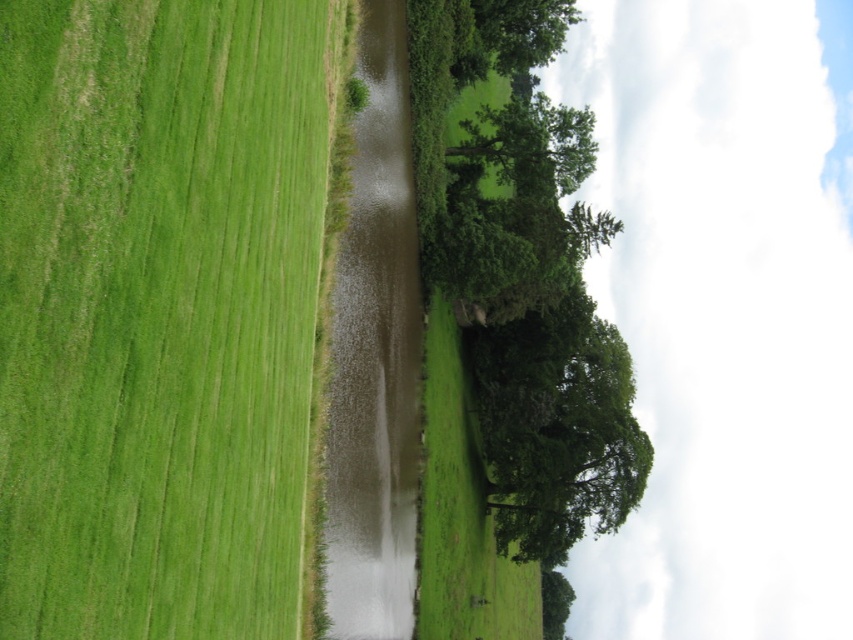
Question: Estimate the real-world distances between objects in this image. Which object is closer to the green leafy tree at center?

Choices:
 (A) muddy water at center
 (B) green grass at left
 (C) green leafy tree at upper center

Answer: (C)

Question: Is green leafy tree at center wider than green leafy tree at upper center?

Choices:
 (A) yes
 (B) no

Answer: (A)

Question: Among these objects, which one is farthest from the camera?

Choices:
 (A) green leafy tree at upper center
 (B) green leafy tree at center

Answer: (A)

Question: Is green leafy tree at center positioned in front of green leafy tree at upper center?

Choices:
 (A) yes
 (B) no

Answer: (A)

Question: Is the position of green grass at left less distant than that of muddy water at center?

Choices:
 (A) yes
 (B) no

Answer: (A)

Question: Among these points, which one is farthest from the camera?

Choices:
 (A) (433, 612)
 (B) (0, 364)

Answer: (A)